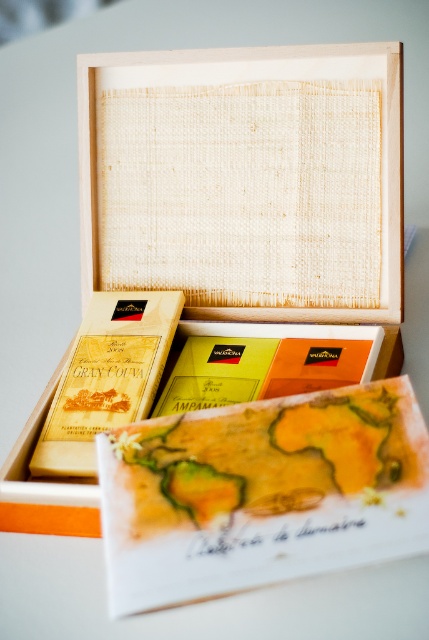
Between wooden box at center and watercolor paper map at center, which one has more height?

Standing taller between the two is wooden box at center.

Between point (308, 241) and point (148, 592), which one is positioned behind?

Point (308, 241)

Is point (148, 168) behind point (356, 477)?

Yes.

Where is `wooden box at center`? wooden box at center is located at coordinates (250, 189).